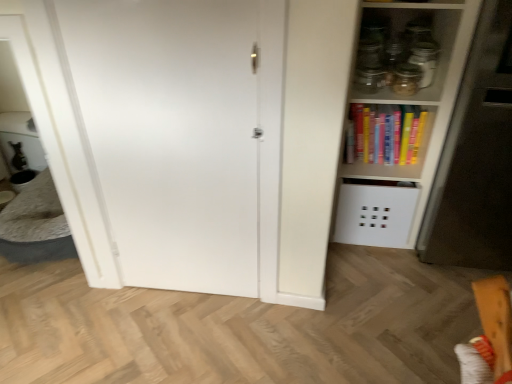
Question: In terms of height, does white matte fridge at right look taller or shorter compared to transparent glass jar at upper right, which appears as the first glass jar when viewed from the left?

Choices:
 (A) short
 (B) tall

Answer: (B)

Question: Is white matte fridge at right spatially inside transparent glass jar at upper right, the second glass jar positioned from the right, or outside of it?

Choices:
 (A) outside
 (B) inside

Answer: (A)

Question: Estimate the real-world distances between objects in this image. Which object is closer to the white matte door at center?

Choices:
 (A) transparent glass jar at upper right, the second glass jar in the left-to-right sequence
 (B) white glossy table at left
 (C) hardcover books at upper right
 (D) transparent glass jar at upper right, the second glass jar positioned from the right
 (E) white matte fridge at right

Answer: (B)

Question: Which is farther from the white matte fridge at right?

Choices:
 (A) hardcover books at upper right
 (B) white matte door at center
 (C) white glossy table at left
 (D) transparent glass jar at upper right, the second glass jar in the left-to-right sequence
 (E) transparent glass jar at upper right, which appears as the first glass jar when viewed from the left

Answer: (C)